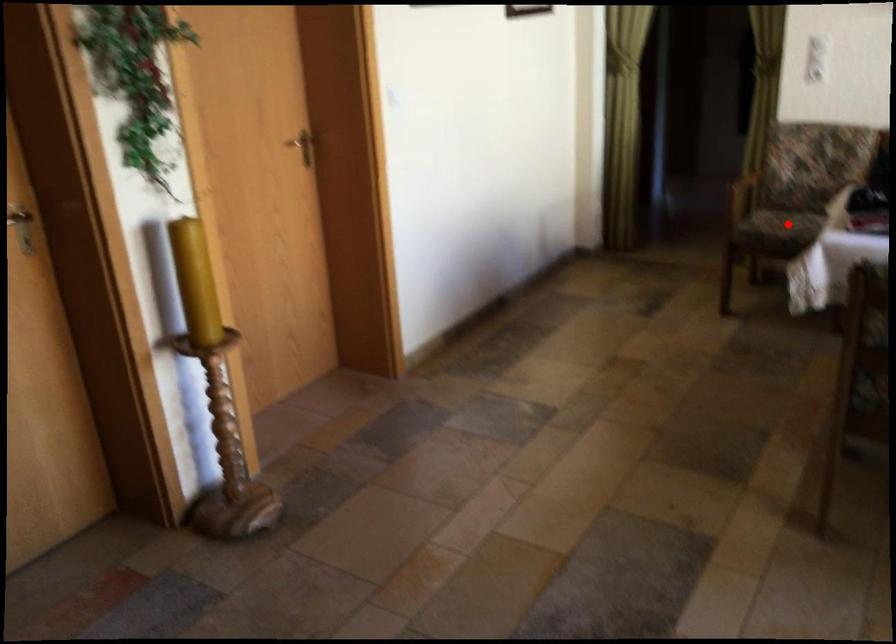
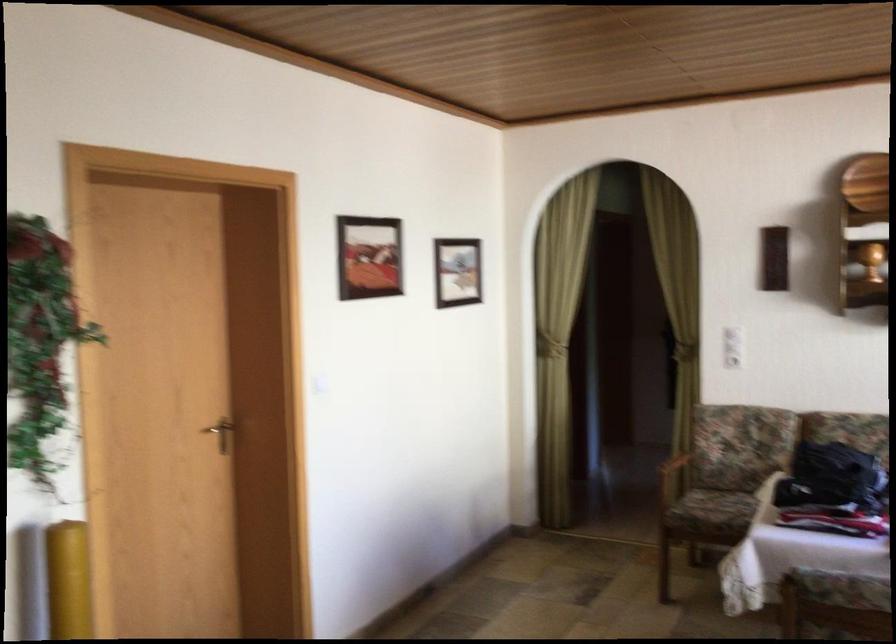
In the second image, find the point that corresponds to the highlighted location in the first image.

(725, 507)